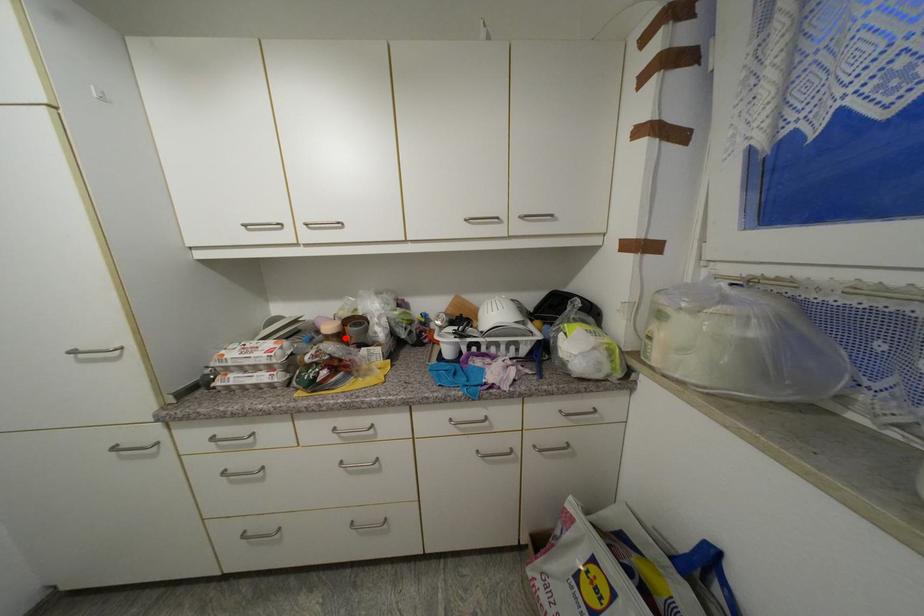
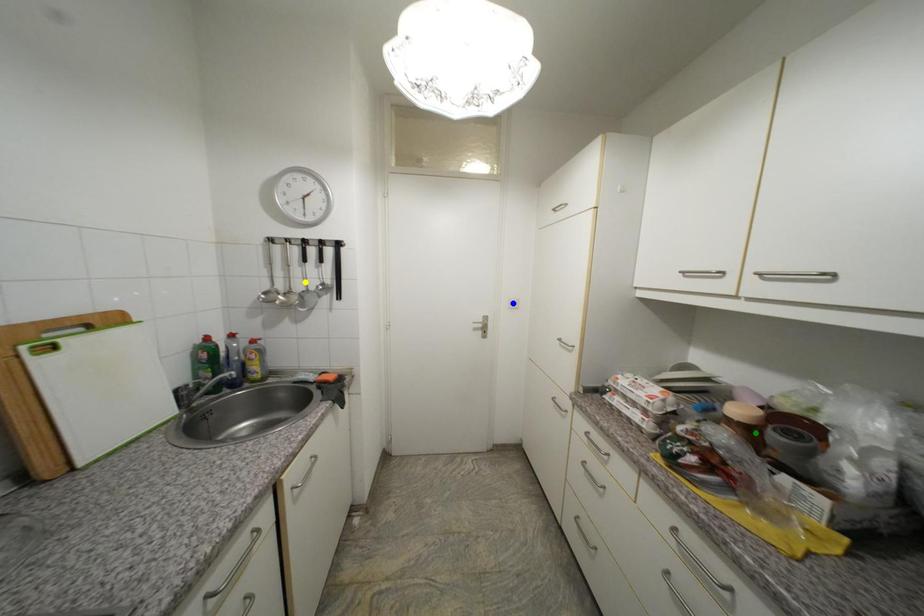
Question: I am providing you with two images of the same scene from different viewpoints. A red point is marked on the first image. You are given multiple points on the second image. Which point in image 2 represents the same 3d spot as the red point in image 1?

Choices:
 (A) blue point
 (B) yellow point
 (C) green point

Answer: (C)